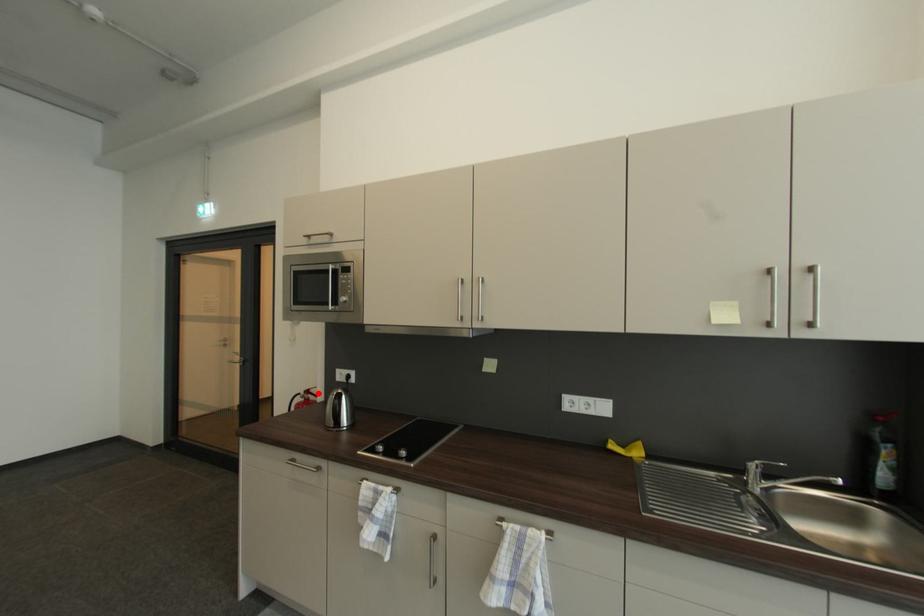
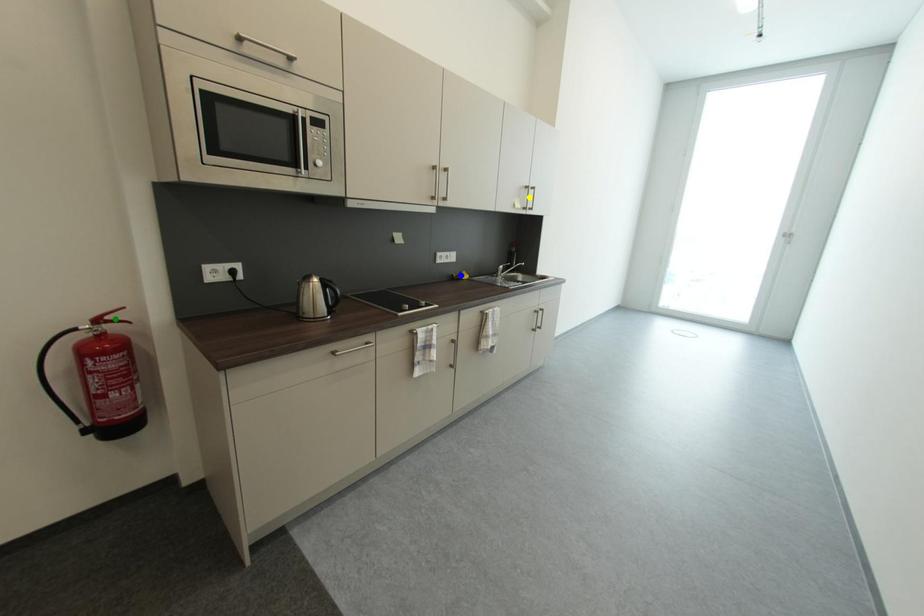
Question: I am providing you with two images of the same scene from different viewpoints. A red point is marked on the first image. You are given multiple points on the second image. Which point in image 2 is actually the same real-world point as the red point in image 1?

Choices:
 (A) yellow point
 (B) green point
 (C) blue point

Answer: (B)